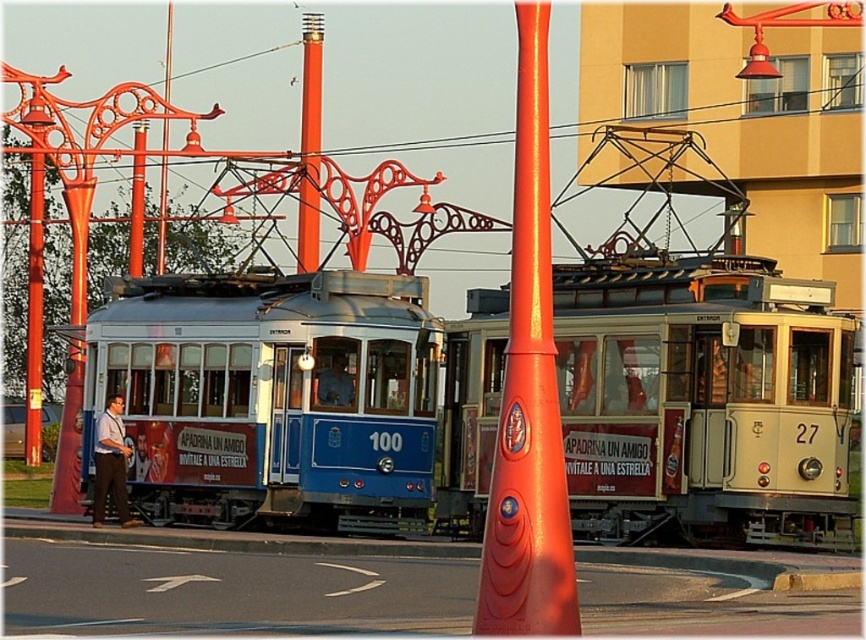
You are a passenger on the blue tram and want to get off at the next stop. However, you notice a point at coordinates (703, 403) that might block your path. Can you determine if this point is on your tram or the cream tram?

The point at coordinates (703, 403) is on the matte cream cable car at center, so it is not on your blue tram. You can safely proceed to the next stop without obstruction from this point.

You are a city planner assessing the space between the metallic pole at center and the metallic red pole at center for installing a new tram stop sign. The sign requires a minimum of 15 feet of clearance between the poles. Is the current spacing sufficient?

The metallic pole at center and metallic red pole at center are 18.55 feet apart from each other, which exceeds the required 15 feet clearance. Therefore, the current spacing is sufficient for installing the new tram stop sign.